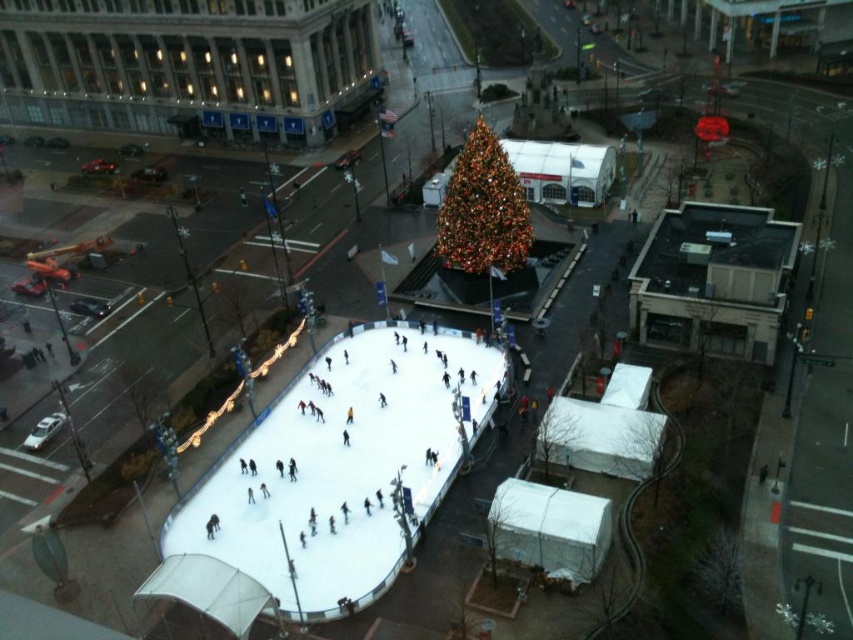
You are standing at point (344, 468) in the city square. What is located at this point?

At point (344, 468) lies the white smooth ice skating rink at center.

You are an ice skater who wants to know if you can skate around the entire perimeter of the white smooth ice skating rink at center without hitting the iridescent glass christmas tree at center. Can you do it?

The white smooth ice skating rink at center is larger in size than the iridescent glass christmas tree at center, so yes, you can skate around the entire perimeter of the white smooth ice skating rink at center without hitting the iridescent glass christmas tree at center because the tree is smaller and likely positioned within the rink area, allowing space for skating around the edges.

You are an ice skater standing on the white smooth ice skating rink at center. You want to glide towards the iridescent glass christmas tree at center. Based on the scene description, can you reach the tree while staying on the ice?

The white smooth ice skating rink at center is in front of the iridescent glass christmas tree at center, so the tree is located behind the rink. Since the rink is surrounded by a blue protective barrier, you cannot reach the tree while staying on the ice.